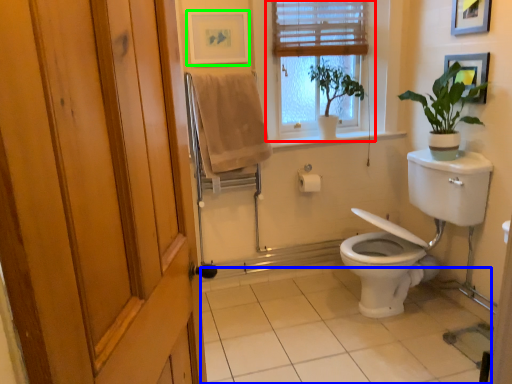
Question: Which object is the closest to the window (highlighted by a red box)? Choose among these: tile (highlighted by a blue box) or picture frame (highlighted by a green box).

Choices:
 (A) tile
 (B) picture frame

Answer: (B)